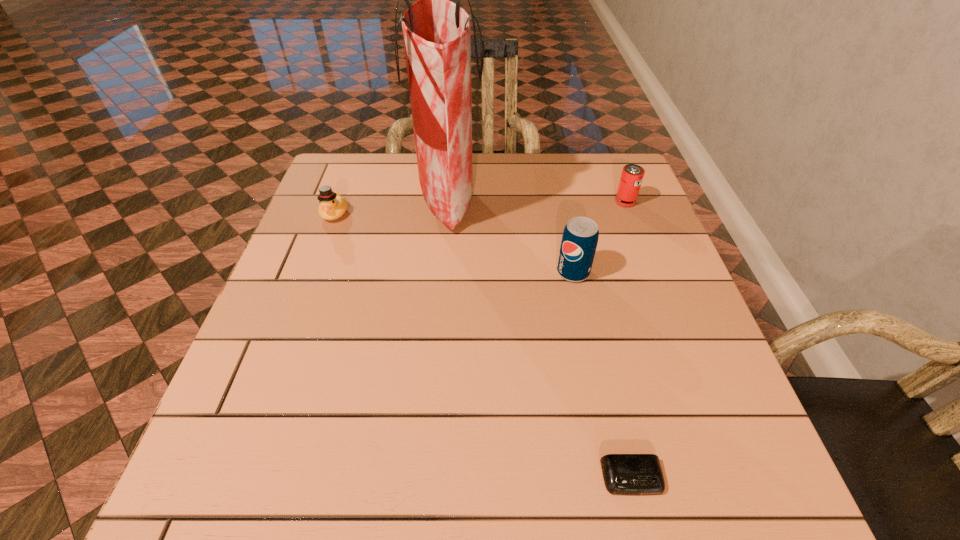
The image size is (960, 540). In order to click on the second object from left to right in this screenshot , I will do `click(437, 33)`.

In order to click on the tallest object in this screenshot , I will do `click(437, 33)`.

Identify the location of the second tallest object. (579, 241).

I want to click on the second nearest object, so click(579, 241).

You are a GUI agent. You are given a task and a screenshot of the screen. Output one action in this format:
    pyautogui.click(x=<x>, y=<y>)
    Task: Click on the rightmost object
    
    Given the screenshot: What is the action you would take?
    pyautogui.click(x=632, y=175)

This screenshot has height=540, width=960. I want to click on the leftmost object, so click(x=332, y=206).

Locate an element on the screen. This screenshot has width=960, height=540. duck is located at coordinates (332, 206).

I want to click on the shortest object, so click(624, 474).

Where is `the nearest object`? Image resolution: width=960 pixels, height=540 pixels. the nearest object is located at coordinates (624, 474).

Find the location of a particular element. This screenshot has height=540, width=960. vacant space positioned 0.200m on the right of the fourth object from right to left is located at coordinates (558, 201).